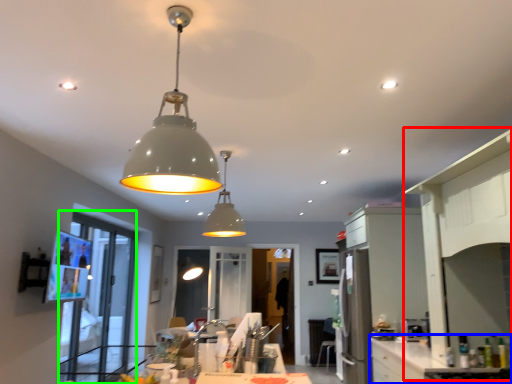
Question: Based on their relative distances, which object is farther from side (highlighted by a red box)? Choose from counter top (highlighted by a blue box) and glass door (highlighted by a green box).

Choices:
 (A) counter top
 (B) glass door

Answer: (B)